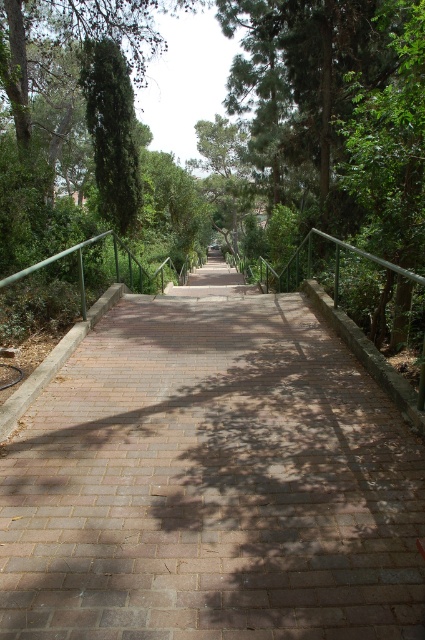
Question: Can you confirm if brick paved path at center is bigger than green leafy tree at upper left?

Choices:
 (A) yes
 (B) no

Answer: (A)

Question: Where is brick paved path at center located in relation to green leafy tree at upper left in the image?

Choices:
 (A) right
 (B) left

Answer: (A)

Question: Which of the following is the closest to the observer?

Choices:
 (A) (127, 195)
 (B) (241, 332)

Answer: (B)

Question: Can you confirm if brick paved path at center is positioned above green leafy tree at upper left?

Choices:
 (A) yes
 (B) no

Answer: (B)